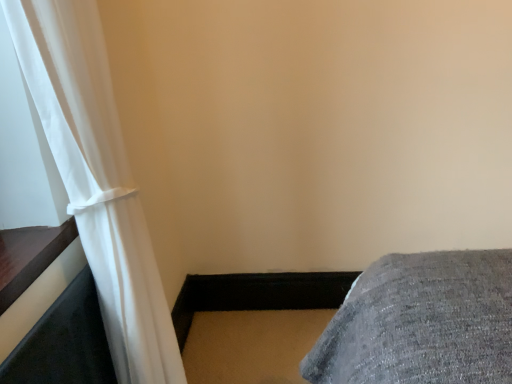
Describe the element at coordinates (97, 179) in the screenshot. I see `white sheer curtain at left` at that location.

This screenshot has width=512, height=384. Find the location of `white sheer curtain at left`. white sheer curtain at left is located at coordinates (97, 179).

Find the location of a particular element. white sheer curtain at left is located at coordinates (97, 179).